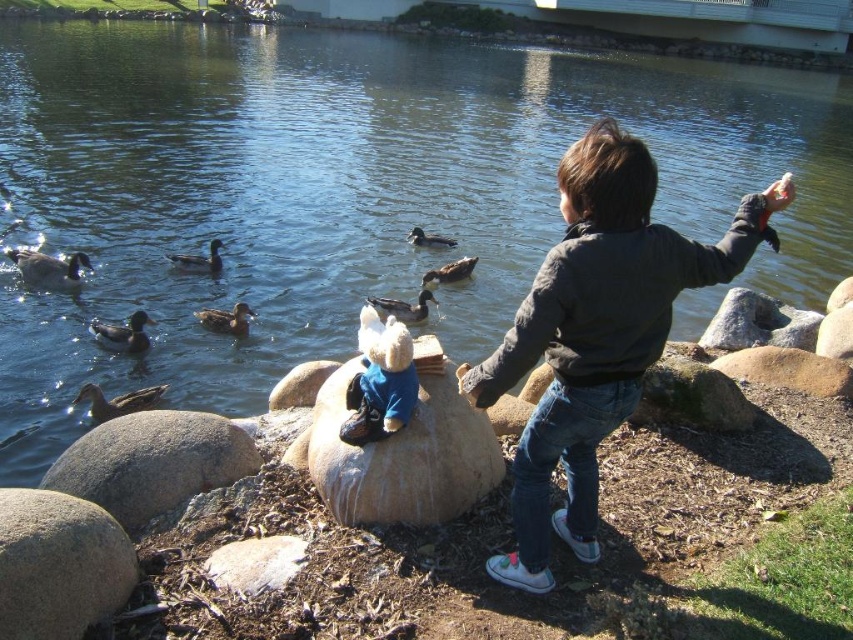
You are the child in the scene holding food to feed the ducks. You want to toss the food to the nearest duck. Which duck should you aim for, the brown matte duck at lower left or the brown matte duck at center?

The brown matte duck at lower left is closer because it is in front of the brown matte duck at center. You should aim for the brown matte duck at lower left.

You are a child holding a small treat in your hand, standing on a patch of dirt and mulch. You see a smooth beige rock at center and a brown matte duck at left. Which object is bigger?

The smooth beige rock at center is larger in size compared to the brown matte duck at left.